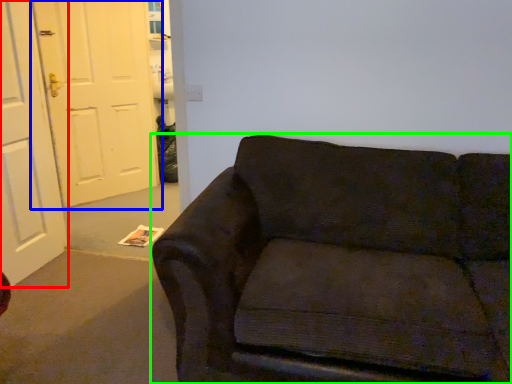
Question: Which object is the closest to the door (highlighted by a red box)? Choose among these: door (highlighted by a blue box) or studio couch (highlighted by a green box).

Choices:
 (A) door
 (B) studio couch

Answer: (A)